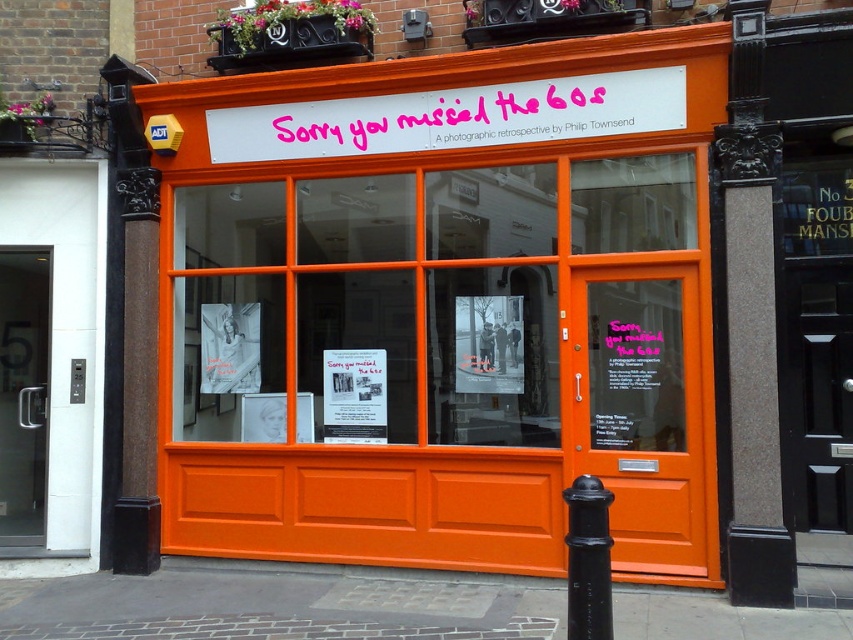
You are a delivery person trying to deliver a package to the shop. The delivery instructions say to place the package between the white plastic signboard at upper center and the black matte pole at lower right. Can you fit the package there if it requires a space of 2.5 meters between the two objects?

The white plastic signboard at upper center and the black matte pole at lower right are 3.07 meters apart from each other. Since 3.07 meters is greater than the required 2.5 meters, the package can be placed between them.

You are standing in front of the shop and want to locate the exact point at coordinates point (451,116). Where is this point located?

The point (451,116) is located on the white plastic signboard at upper center.

You are a delivery person trying to locate the entrance to the shop. You see the white plastic signboard at upper center and the black matte pole at lower right. Which object is closer to the entrance?

The black matte pole at lower right is closer to the entrance because it is positioned below the white plastic signboard at upper center, which is above it.